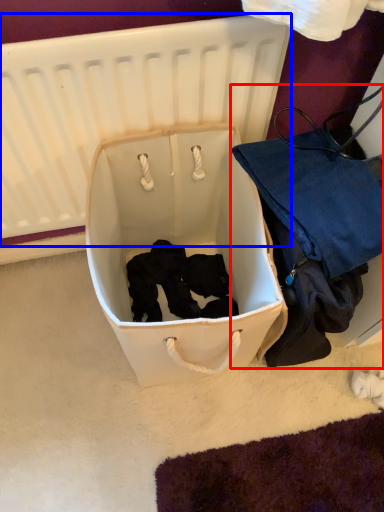
Question: Which object appears farthest to the camera in this image, luggage and bags (highlighted by a red box) or infant bed (highlighted by a blue box)?

Choices:
 (A) luggage and bags
 (B) infant bed

Answer: (A)